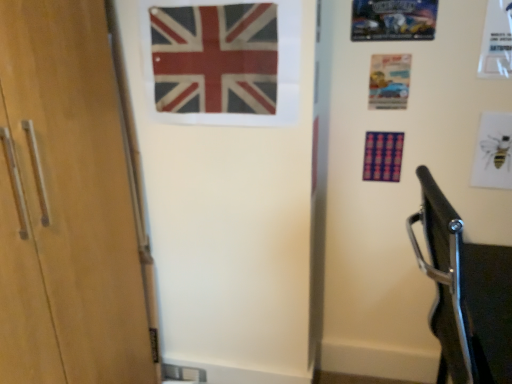
Question: Should I look upward or downward to see matte paper postcard at upper right, the 2th postcard in the left-to-right sequence?

Choices:
 (A) down
 (B) up

Answer: (B)

Question: From the image's perspective, is white paper bee at upper right, placed as the 1th postcard when sorted from right to left, on metallic silver car at upper right, acting as the first postcard starting from the left?

Choices:
 (A) yes
 (B) no

Answer: (B)

Question: Considering the relative sizes of white paper bee at upper right, positioned as the first postcard in bottom-to-top order, and metallic silver car at upper right, acting as the first postcard starting from the left, in the image provided, is white paper bee at upper right, positioned as the first postcard in bottom-to-top order, wider than metallic silver car at upper right, acting as the first postcard starting from the left,?

Choices:
 (A) no
 (B) yes

Answer: (B)

Question: Is metallic silver car at upper right, the 1th postcard in the top-to-bottom sequence, a part of white paper bee at upper right, positioned as the first postcard in bottom-to-top order?

Choices:
 (A) no
 (B) yes

Answer: (A)

Question: Is white paper bee at upper right, positioned as the first postcard in bottom-to-top order, positioned with its back to metallic silver car at upper right, which is counted as the third postcard, starting from the bottom?

Choices:
 (A) no
 (B) yes

Answer: (A)

Question: Is white paper bee at upper right, placed as the 1th postcard when sorted from right to left, shorter than metallic silver car at upper right, which is the 3th postcard from right to left?

Choices:
 (A) yes
 (B) no

Answer: (B)

Question: Does white paper bee at upper right, the third postcard viewed from the top, have a lesser width compared to metallic silver car at upper right, which is the 3th postcard from right to left?

Choices:
 (A) no
 (B) yes

Answer: (A)

Question: Is white paper bee at upper right, the third postcard viewed from the top, to the right of red and white fabric flag at upper center from the viewer's perspective?

Choices:
 (A) yes
 (B) no

Answer: (A)

Question: Would you say red and white fabric flag at upper center is part of white paper bee at upper right, acting as the 3th postcard starting from the left,'s contents?

Choices:
 (A) yes
 (B) no

Answer: (B)

Question: Is white paper bee at upper right, acting as the 3th postcard starting from the left, taller than red and white fabric flag at upper center?

Choices:
 (A) yes
 (B) no

Answer: (B)

Question: From a real-world perspective, is white paper bee at upper right, positioned as the first postcard in bottom-to-top order, under red and white fabric flag at upper center?

Choices:
 (A) no
 (B) yes

Answer: (B)

Question: Is white paper bee at upper right, acting as the 3th postcard starting from the left, not inside red and white fabric flag at upper center?

Choices:
 (A) no
 (B) yes

Answer: (B)

Question: Is white paper bee at upper right, placed as the 1th postcard when sorted from right to left, positioned before red and white fabric flag at upper center?

Choices:
 (A) no
 (B) yes

Answer: (A)

Question: Is matte paper postcard at upper right, acting as the second postcard starting from the top, in front of metallic silver car at upper right, the 1th postcard in the top-to-bottom sequence?

Choices:
 (A) yes
 (B) no

Answer: (B)